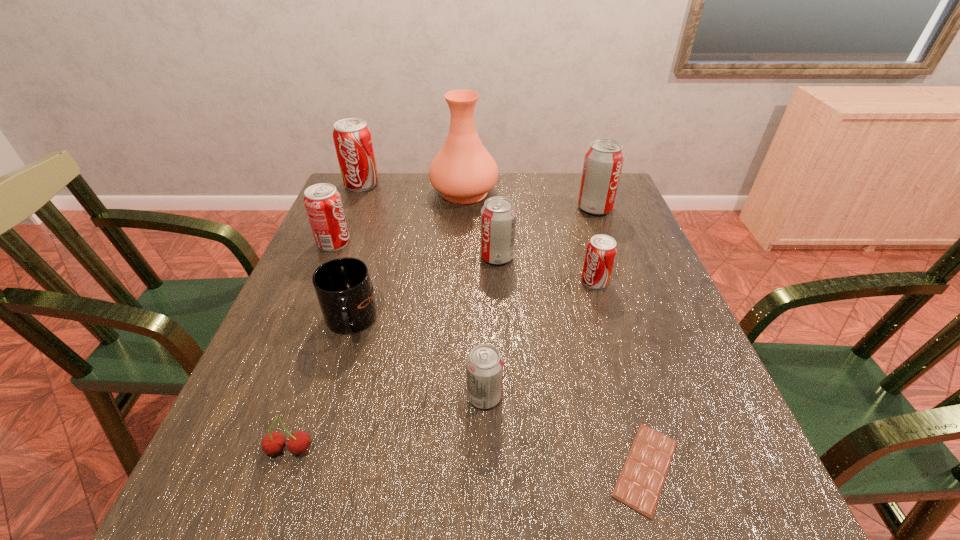
This screenshot has height=540, width=960. What are the coordinates of `the closest red soda can to the black mug` in the screenshot? It's located at (323, 203).

Find the location of a particular element. The image size is (960, 540). the third closest red soda can to the ninth tallest object is located at coordinates (352, 137).

Choose which gray soda can is the second nearest neighbor to the shortest object. Please provide its 2D coordinates. Your answer should be formatted as a tuple, i.e. [(x, y)], where the tuple contains the x and y coordinates of a point satisfying the conditions above.

[(498, 215)]

In order to click on gray soda can that is the third closest to the cherry in this screenshot , I will do `click(603, 162)`.